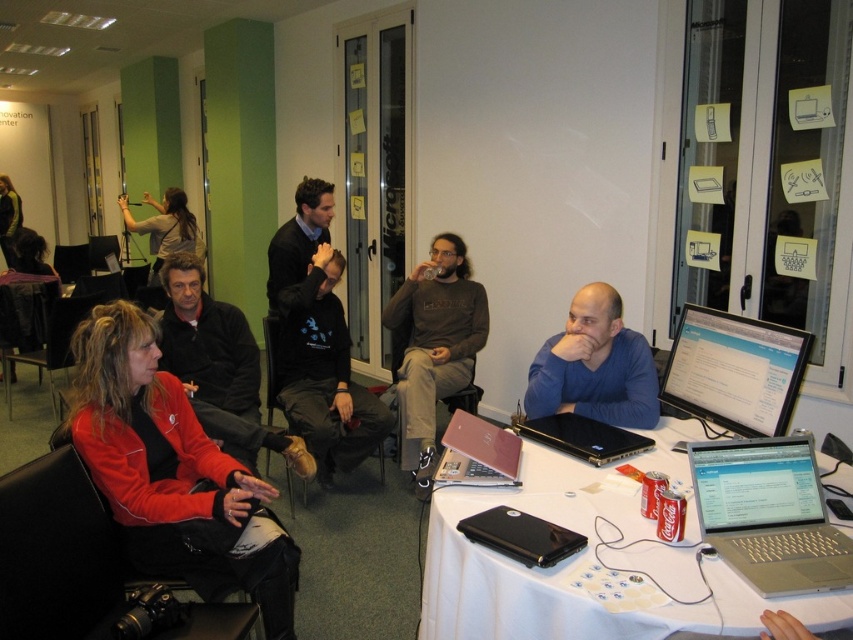
You are a person sitting at the table in the image. You want to reach for the black glossy laptop at center without disturbing the matte black hair at upper left. Is the laptop accessible from your current position?

The black glossy laptop at center is positioned under matte black hair at upper left, so it might be accessible as long as you can reach under the hair without disturbing it.

You are a photographer taking a group photo of the meeting participants. The blue matte shirt at center and the black glossy laptop at center are both in your frame. Which object should you focus on if you want to capture the larger one clearly?

The blue matte shirt at center is bigger than the black glossy laptop at center, so you should focus on the blue matte shirt at center to capture the larger one clearly.

You are a photographer standing in the room and want to take a photo of the silver metallic laptop at lower right and the matte black hair at upper left. Which object is shorter in height?

The silver metallic laptop at lower right has a lesser height compared to matte black hair at upper left, so the silver metallic laptop at lower right is shorter in height.